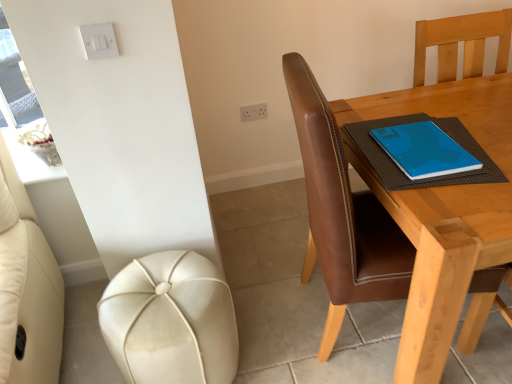
Question: Considering the relative positions of blue matte notebook at upper right and brown leather chair at right in the image provided, is blue matte notebook at upper right to the left or to the right of brown leather chair at right?

Choices:
 (A) right
 (B) left

Answer: (A)

Question: Is blue matte notebook at upper right in front of or behind brown leather chair at right in the image?

Choices:
 (A) front
 (B) behind

Answer: (B)

Question: Which of these objects is positioned farthest from the brown leather chair at right?

Choices:
 (A) leather-like cream stool at lower left
 (B) white plastic socket at upper center
 (C) white plastic light switch at upper left
 (D) blue matte notebook at upper right

Answer: (B)

Question: Which object is the closest to the brown leather chair at right?

Choices:
 (A) blue matte notebook at upper right
 (B) white plastic socket at upper center
 (C) white plastic light switch at upper left
 (D) leather-like cream stool at lower left

Answer: (A)